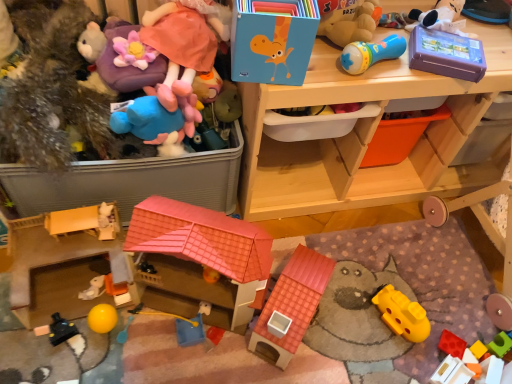
Identify the location of free space to the left of white plastic toy at lower right, the twelfth toy from the left. (386, 352).